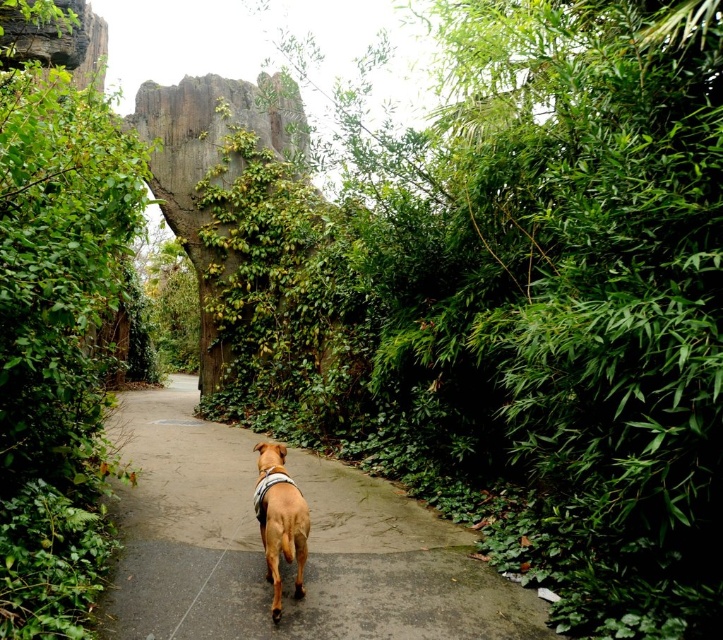
Question: Which point appears farthest from the camera in this image?

Choices:
 (A) (27, 340)
 (B) (701, 340)
 (C) (197, 115)

Answer: (C)

Question: Does green mossy rock at center appear under brown matte dog at center?

Choices:
 (A) no
 (B) yes

Answer: (A)

Question: Which of the following is the farthest from the observer?

Choices:
 (A) (69, 324)
 (B) (265, 560)
 (C) (218, 212)
 (D) (149, 435)

Answer: (C)

Question: Which of these objects is positioned farthest from the green leafy foliage at center?

Choices:
 (A) brown concrete path at center
 (B) green mossy rock at center

Answer: (B)

Question: Is green leafy foliage at center above green mossy rock at center?

Choices:
 (A) yes
 (B) no

Answer: (B)

Question: From the image, what is the correct spatial relationship of green leafy bush at left in relation to green mossy rock at center?

Choices:
 (A) left
 (B) right

Answer: (B)